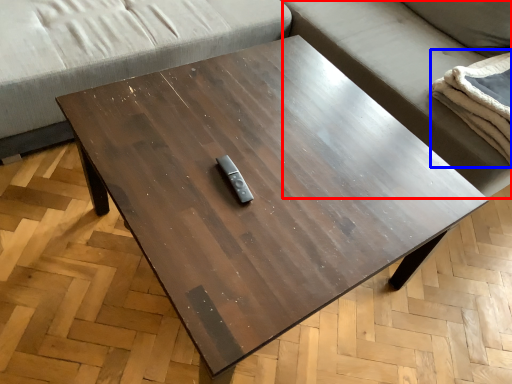
Question: Which object appears farthest to the camera in this image, couch (highlighted by a red box) or blanket (highlighted by a blue box)?

Choices:
 (A) couch
 (B) blanket

Answer: (B)